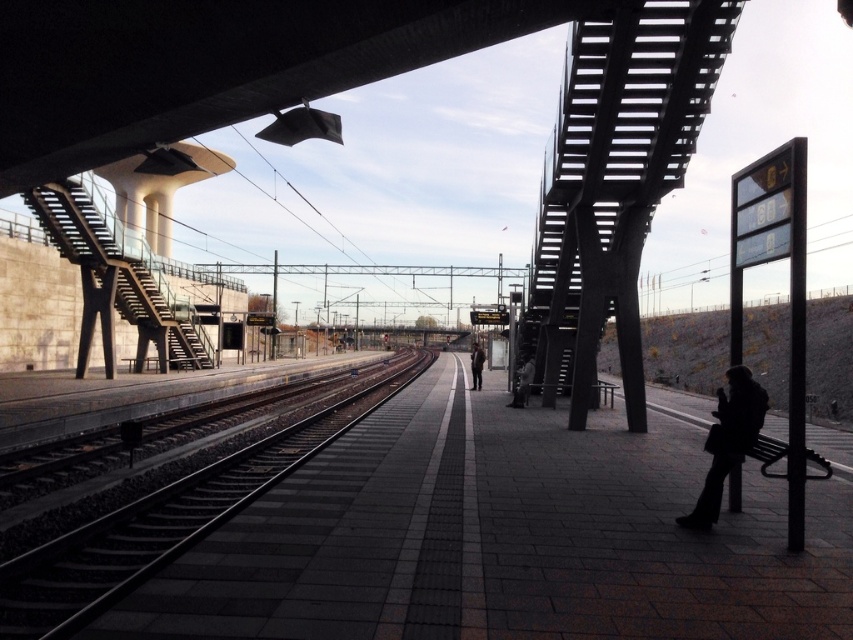
Question: Which of the following is the closest to the observer?

Choices:
 (A) dark gray jacket at center
 (B) dark gray metal train track at center

Answer: (B)

Question: Does dark gray metal train track at center have a lesser width compared to dark brown leather jacket at center?

Choices:
 (A) yes
 (B) no

Answer: (A)

Question: Estimate the real-world distances between objects in this image. Which object is farther from the dark brown leather jacket at center?

Choices:
 (A) dark gray jacket at center
 (B) black leather coat at lower right
 (C) dark gray metal train track at center

Answer: (B)

Question: Is dark gray jacket at center bigger than dark brown leather jacket at center?

Choices:
 (A) no
 (B) yes

Answer: (A)

Question: Estimate the real-world distances between objects in this image. Which object is closer to the black leather coat at lower right?

Choices:
 (A) dark brown leather jacket at center
 (B) dark gray jacket at center
 (C) dark gray metal train track at center

Answer: (B)

Question: Can you confirm if black leather coat at lower right is smaller than dark gray jacket at center?

Choices:
 (A) no
 (B) yes

Answer: (A)